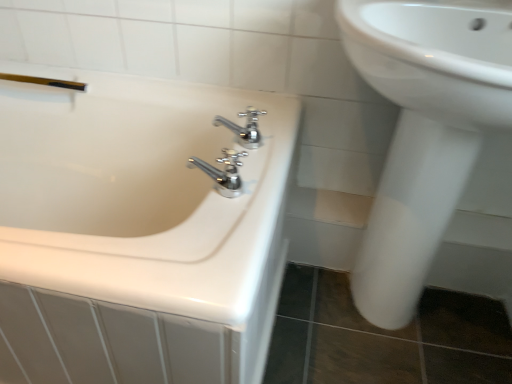
Question: From a real-world perspective, is chrome metallic faucet at center, arranged as the first tap when viewed from the top, over white glossy bathtub at left?

Choices:
 (A) no
 (B) yes

Answer: (B)

Question: Does chrome metallic faucet at center, the 2th tap ordered from the bottom, have a smaller size compared to white glossy bathtub at left?

Choices:
 (A) yes
 (B) no

Answer: (A)

Question: Is chrome metallic faucet at center, the 2th tap ordered from the bottom, positioned with its back to white glossy bathtub at left?

Choices:
 (A) yes
 (B) no

Answer: (B)

Question: Is chrome metallic faucet at center, which ranks as the 2th tap in front-to-back order, at the left side of white glossy bathtub at left?

Choices:
 (A) no
 (B) yes

Answer: (A)

Question: Can you confirm if chrome metallic faucet at center, the 2th tap ordered from the bottom, is shorter than white glossy bathtub at left?

Choices:
 (A) no
 (B) yes

Answer: (B)

Question: Looking at the image, does white glossy bathtub at left seem bigger or smaller compared to white glossy sink at right?

Choices:
 (A) small
 (B) big

Answer: (B)

Question: From a real-world perspective, relative to white glossy sink at right, is white glossy bathtub at left vertically above or below?

Choices:
 (A) below
 (B) above

Answer: (A)

Question: Relative to white glossy sink at right, is white glossy bathtub at left in front or behind?

Choices:
 (A) front
 (B) behind

Answer: (B)

Question: From the image's perspective, is white glossy bathtub at left positioned above or below white glossy sink at right?

Choices:
 (A) below
 (B) above

Answer: (A)

Question: Is point (290, 155) closer or farther from the camera than point (58, 81)?

Choices:
 (A) closer
 (B) farther

Answer: (A)

Question: Is white glossy bathtub at left situated inside gold metallic shower at upper left or outside?

Choices:
 (A) outside
 (B) inside

Answer: (A)

Question: Considering the positions of white glossy bathtub at left and gold metallic shower at upper left in the image, is white glossy bathtub at left taller or shorter than gold metallic shower at upper left?

Choices:
 (A) short
 (B) tall

Answer: (B)

Question: From a real-world perspective, is white glossy bathtub at left above or below gold metallic shower at upper left?

Choices:
 (A) above
 (B) below

Answer: (B)

Question: Does point (251, 117) appear closer or farther from the camera than point (385, 94)?

Choices:
 (A) closer
 (B) farther

Answer: (B)

Question: Is chrome metallic faucet at center, the 2th tap ordered from the bottom, to the left or to the right of white glossy sink at right in the image?

Choices:
 (A) left
 (B) right

Answer: (A)